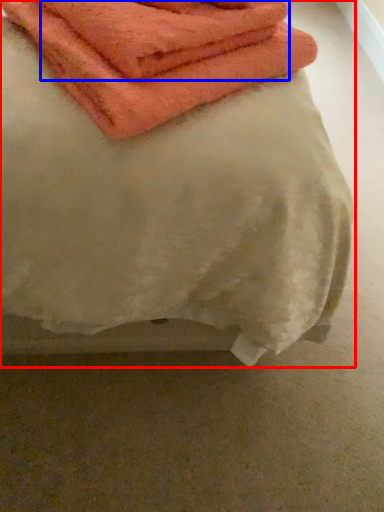
Question: Which of the following is the farthest to the observer, towel (highlighted by a red box) or towel (highlighted by a blue box)?

Choices:
 (A) towel
 (B) towel

Answer: (B)